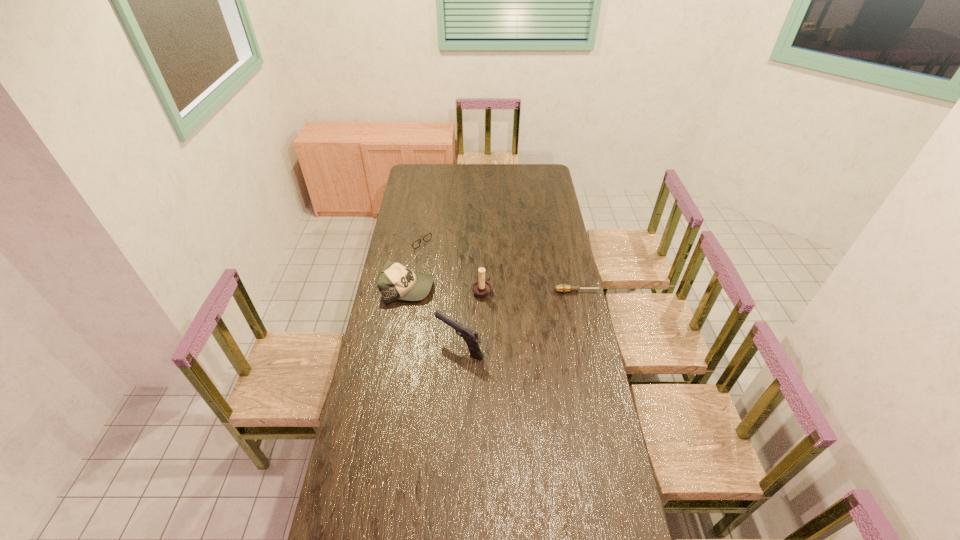
Where is `the nearest object`? Image resolution: width=960 pixels, height=540 pixels. the nearest object is located at coordinates (470, 336).

You are a GUI agent. You are given a task and a screenshot of the screen. Output one action in this format:
    pyautogui.click(x=<x>, y=<y>)
    Task: Click on the screwdriver
    Image resolution: width=960 pixels, height=540 pixels.
    Given the screenshot: What is the action you would take?
    pyautogui.click(x=562, y=288)

Find the location of a particular element. the rightmost object is located at coordinates coord(562,288).

Locate an element on the screen. The height and width of the screenshot is (540, 960). the third tallest object is located at coordinates (396, 281).

Find the location of a particular element. The image size is (960, 540). the farthest object is located at coordinates (426, 238).

Find the location of `the second shortest object`. the second shortest object is located at coordinates (426, 238).

Find the location of a particular element. This screenshot has height=540, width=960. candle holder is located at coordinates (481, 288).

Identify the location of free spot located at the muzzle of the nearest object. Image resolution: width=960 pixels, height=540 pixels. (379, 346).

Locate an element on the screen. vacant region located 0.210m at the muzzle of the nearest object is located at coordinates (386, 346).

Identify the location of free space located at the muzzle of the nearest object. This screenshot has width=960, height=540. (400, 346).